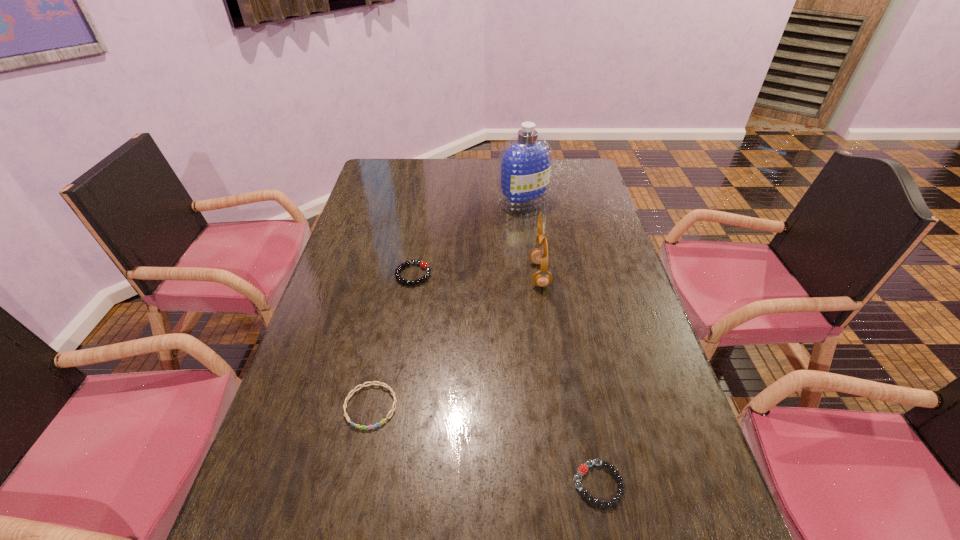
Where is `vacant area located 0.120m on the front-facing side of the second tallest object`? This screenshot has width=960, height=540. vacant area located 0.120m on the front-facing side of the second tallest object is located at coordinates (490, 275).

Identify the location of vacant space positioned 0.050m on the front of the farthest bracelet. The width and height of the screenshot is (960, 540). (409, 299).

Identify the location of vacant area located 0.180m on the surface of the second nearest bracelet showing star-shaped elements. The width and height of the screenshot is (960, 540). (348, 519).

You are a GUI agent. You are given a task and a screenshot of the screen. Output one action in this format:
    pyautogui.click(x=<x>, y=<y>)
    Task: Click on the vacant region located on the back of the rightmost bracelet
    This screenshot has height=540, width=960.
    Given the screenshot: What is the action you would take?
    pyautogui.click(x=573, y=355)

I want to click on object present at the left edge, so click(x=392, y=410).

In the image, there is a desktop. Where is `free space at the far edge`? free space at the far edge is located at coordinates (488, 171).

Identify the location of vacant region at the left edge of the desktop. (297, 368).

The width and height of the screenshot is (960, 540). What are the coordinates of `vacant area at the right edge` in the screenshot? It's located at [x=582, y=213].

Locate an element on the screen. The image size is (960, 540). free area in between the second nearest bracelet and the nearest object is located at coordinates (485, 445).

At what (x,y) coordinates should I click in order to perform the action: click on vacant point located between the cleansing agent and the earphone. Please return your answer as a coordinate pair (x, y). The image size is (960, 540). Looking at the image, I should click on (531, 238).